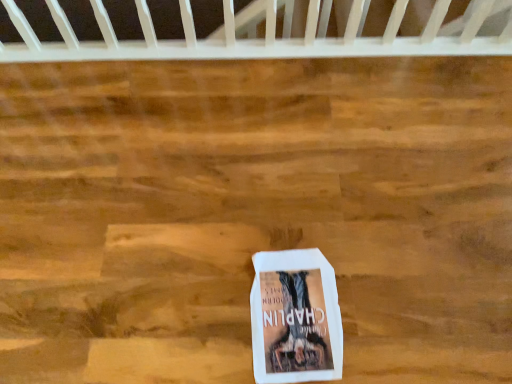
I want to click on free space above white paper book at center (from a real-world perspective), so click(x=293, y=307).